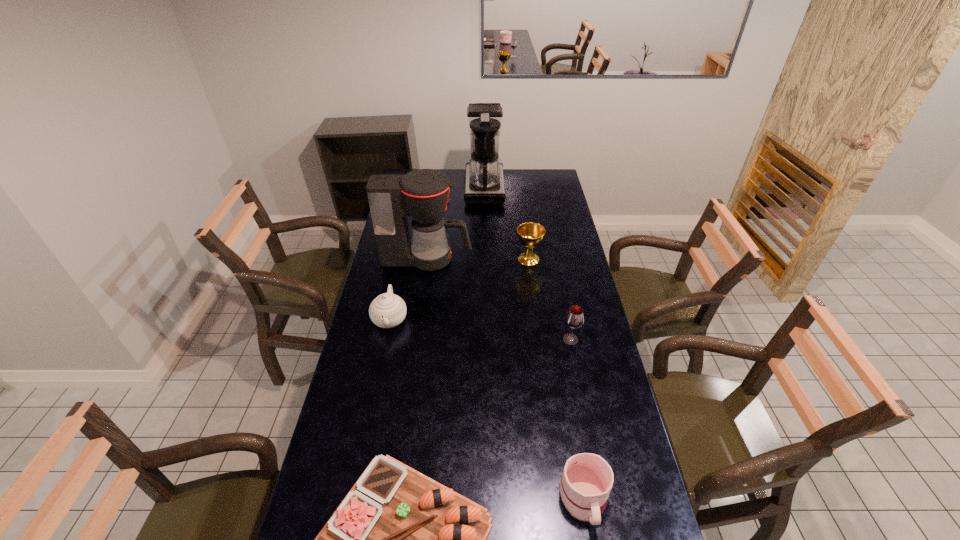
Where is `the farthest object`? The width and height of the screenshot is (960, 540). the farthest object is located at coordinates (484, 183).

The width and height of the screenshot is (960, 540). In order to click on the nearer coffee maker in this screenshot , I will do `click(422, 194)`.

Identify the location of chalice. The height and width of the screenshot is (540, 960). (530, 234).

This screenshot has width=960, height=540. Identify the location of wineglass. (574, 318).

The image size is (960, 540). Find the location of `chinaware`. chinaware is located at coordinates (388, 310).

Where is `mug`? mug is located at coordinates (586, 481).

Identify the location of free space located at the front of the farthest object where the controls are located. (445, 187).

Identify the location of blank area located at the front of the farthest object where the controls are located. (449, 187).

The image size is (960, 540). I want to click on vacant space located at the front of the farthest object where the controls are located, so click(420, 187).

Locate an element on the screen. The height and width of the screenshot is (540, 960). vacant space located 0.130m pour from the carafe of the nearer coffee maker is located at coordinates (500, 259).